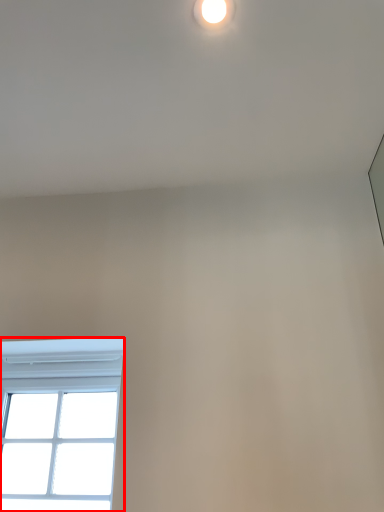
Question: From the image's perspective, considering the relative positions of window (annotated by the red box) and droplight in the image provided, where is window (annotated by the red box) located with respect to the staircase?

Choices:
 (A) below
 (B) above

Answer: (A)